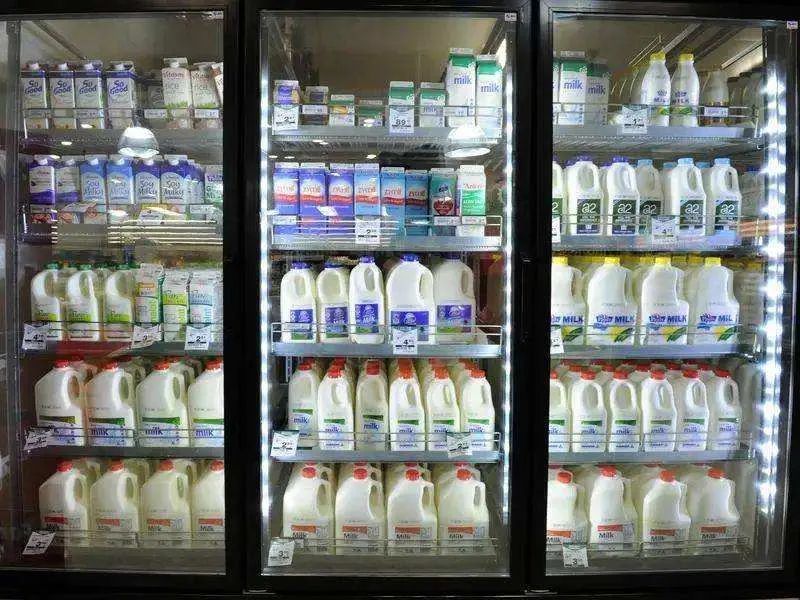
Find the location of a particular element. This screenshot has width=800, height=600. medium jugs with yellow tops is located at coordinates (568, 295), (606, 286), (658, 301), (720, 306), (698, 280), (674, 265), (645, 273), (629, 265), (594, 274).